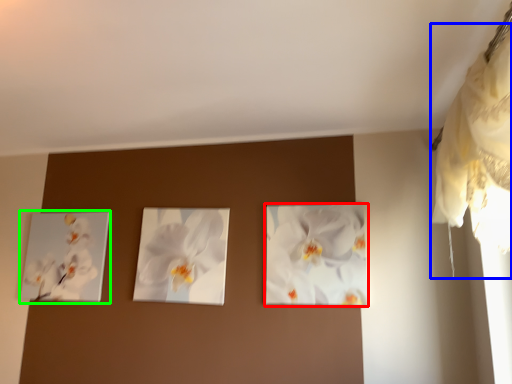
Question: Which is nearer to the flower (highlighted by a red box)? curtain (highlighted by a blue box) or picture frame (highlighted by a green box).

Choices:
 (A) curtain
 (B) picture frame

Answer: (A)